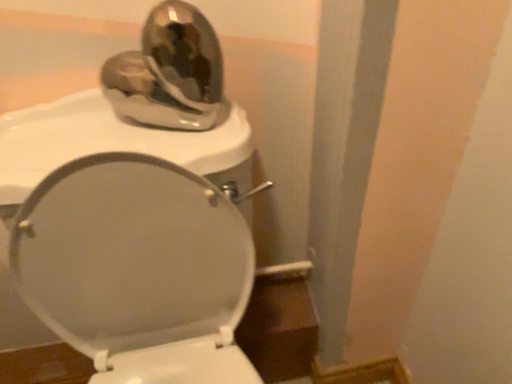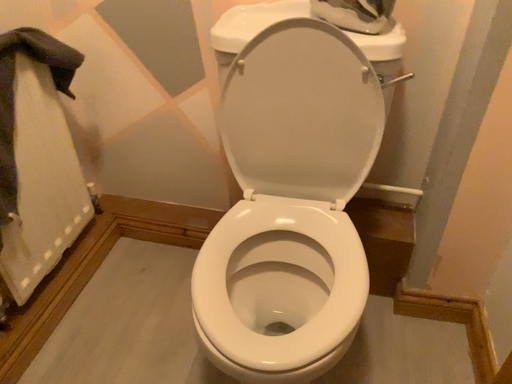
Question: How did the camera likely rotate when shooting the video?

Choices:
 (A) rotated right
 (B) rotated left

Answer: (B)